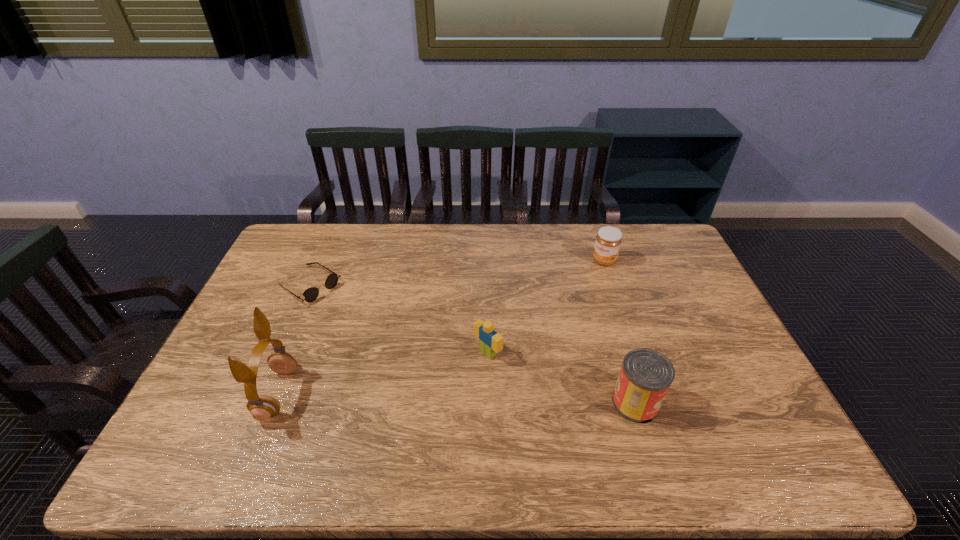
The height and width of the screenshot is (540, 960). Find the location of `vacant space on the desktop that is between the tallest object and the can and is positioned on the face of the Lego`. vacant space on the desktop that is between the tallest object and the can and is positioned on the face of the Lego is located at coordinates (429, 397).

Identify the location of free spot on the desktop that is between the earphone and the fourth shortest object and is positioned on the front label of the jam. (481, 399).

The image size is (960, 540). Find the location of `free space on the desktop that is between the tallest object and the can and is positioned on the front-facing side of the shortest object`. free space on the desktop that is between the tallest object and the can and is positioned on the front-facing side of the shortest object is located at coordinates (486, 399).